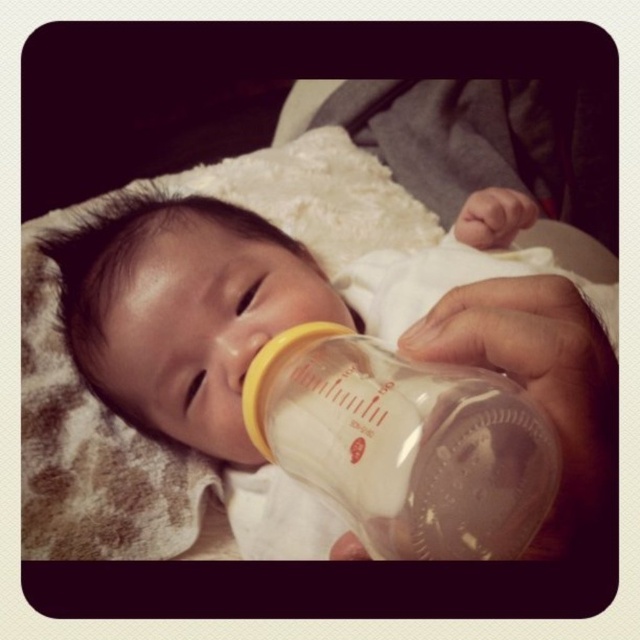
You are a caregiver holding a baby and need to choose between the transparent plastic bottle at center and the transparent plastic baby bottle at center. Which one is positioned to the right?

The transparent plastic bottle at center is to the right of the transparent plastic baby bottle at center.

Where is the transparent plastic bottle at center located in the image?

The transparent plastic bottle at center is located at point (228,305).

You are a caregiver holding two bottles in the image. One is the transparent plastic bottle at center and the other is the transparent plastic baby bottle at center. Which one is closer to you?

The transparent plastic bottle at center is closer to you because the transparent plastic baby bottle at center is behind it.